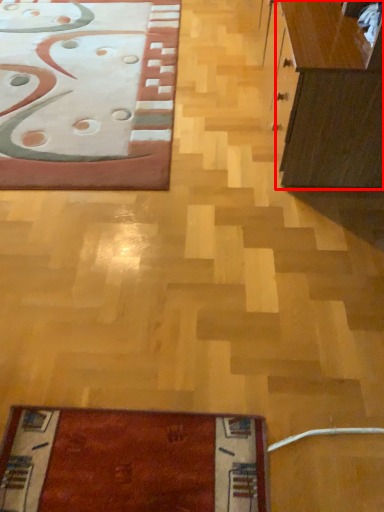
Question: From the image's perspective, where is cabinetry (annotated by the red box) located in relation to furniture in the image?

Choices:
 (A) above
 (B) below

Answer: (B)